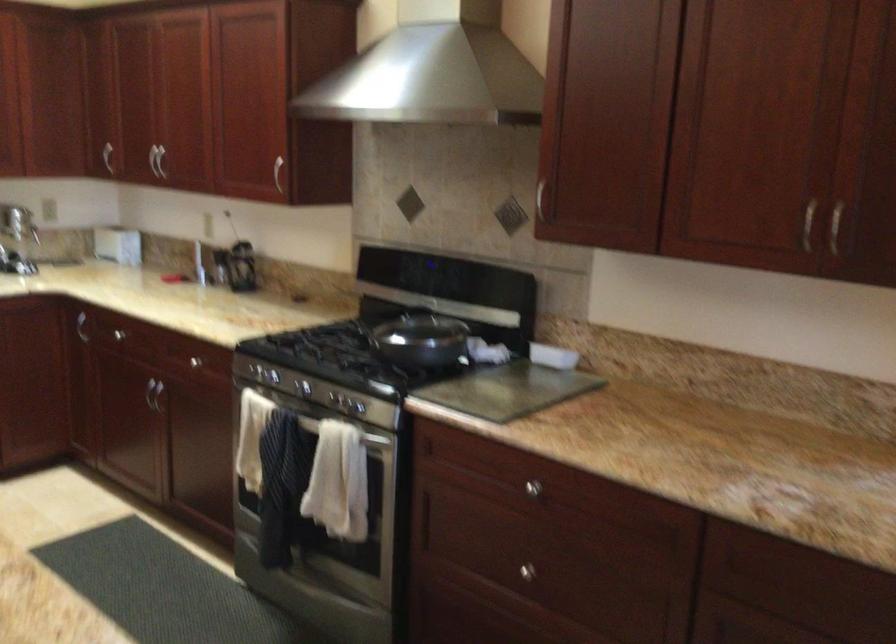
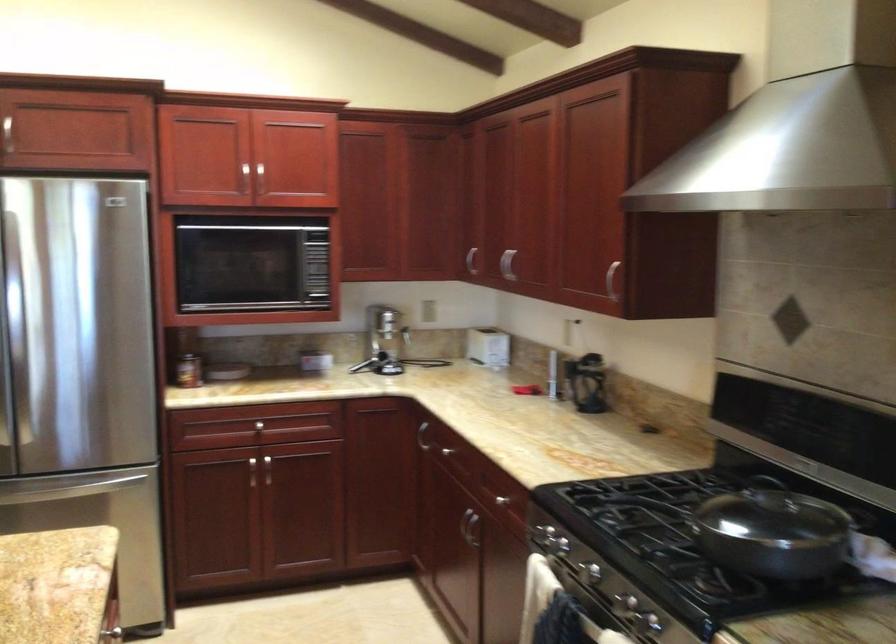
Find the pixel in the second image that matches [80,316] in the first image.

(421, 436)